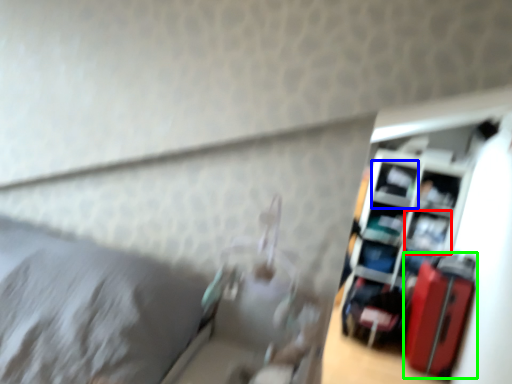
Question: Based on their relative distances, which object is nearer to shelf (highlighted by a red box)? Choose from shelf (highlighted by a blue box) and luggage (highlighted by a green box).

Choices:
 (A) shelf
 (B) luggage

Answer: (A)